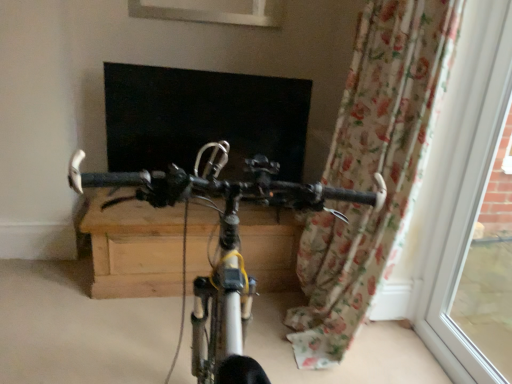
Question: Can you confirm if floral fabric curtain at right is shorter than metallic silver bicycle at center?

Choices:
 (A) no
 (B) yes

Answer: (A)

Question: Would you say floral fabric curtain at right contains metallic silver bicycle at center?

Choices:
 (A) yes
 (B) no

Answer: (B)

Question: Could you tell me if floral fabric curtain at right is facing metallic silver bicycle at center?

Choices:
 (A) yes
 (B) no

Answer: (B)

Question: From the image's perspective, is floral fabric curtain at right on metallic silver bicycle at center?

Choices:
 (A) no
 (B) yes

Answer: (B)

Question: Is floral fabric curtain at right next to metallic silver bicycle at center and touching it?

Choices:
 (A) no
 (B) yes

Answer: (A)

Question: In the image, is metallic silver bicycle at center positioned in front of or behind white plastic window frame at right?

Choices:
 (A) front
 (B) behind

Answer: (A)

Question: In terms of size, does metallic silver bicycle at center appear bigger or smaller than white plastic window frame at right?

Choices:
 (A) small
 (B) big

Answer: (B)

Question: From a real-world perspective, relative to white plastic window frame at right, is metallic silver bicycle at center vertically above or below?

Choices:
 (A) above
 (B) below

Answer: (B)

Question: Does point (x=221, y=357) appear closer or farther from the camera than point (x=497, y=39)?

Choices:
 (A) farther
 (B) closer

Answer: (B)

Question: From the image's perspective, is white plastic window frame at right positioned above or below metallic silver bicycle at center?

Choices:
 (A) below
 (B) above

Answer: (B)

Question: From a real-world perspective, relative to metallic silver bicycle at center, is white plastic window frame at right vertically above or below?

Choices:
 (A) below
 (B) above

Answer: (B)

Question: Is white plastic window frame at right situated inside metallic silver bicycle at center or outside?

Choices:
 (A) inside
 (B) outside

Answer: (B)

Question: In terms of width, does white plastic window frame at right look wider or thinner when compared to metallic silver bicycle at center?

Choices:
 (A) wide
 (B) thin

Answer: (B)

Question: Is white plastic window frame at right wider or thinner than floral fabric curtain at right?

Choices:
 (A) thin
 (B) wide

Answer: (A)

Question: From the image's perspective, is white plastic window frame at right above or below floral fabric curtain at right?

Choices:
 (A) above
 (B) below

Answer: (B)